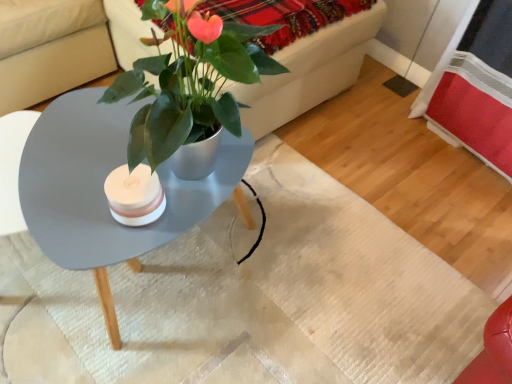
Question: From their relative heights in the image, would you say metallic green plant at center is taller or shorter than velvet red blanket at upper center?

Choices:
 (A) tall
 (B) short

Answer: (A)

Question: In the image, is metallic green plant at center positioned in front of or behind velvet red blanket at upper center?

Choices:
 (A) front
 (B) behind

Answer: (A)

Question: Estimate the real-world distances between objects in this image. Which object is closer to the velvet red blanket at upper center?

Choices:
 (A) matte gray coffee table at center
 (B) metallic green plant at center

Answer: (B)

Question: Estimate the real-world distances between objects in this image. Which object is farther from the metallic green plant at center?

Choices:
 (A) matte gray coffee table at center
 (B) velvet red blanket at upper center

Answer: (A)